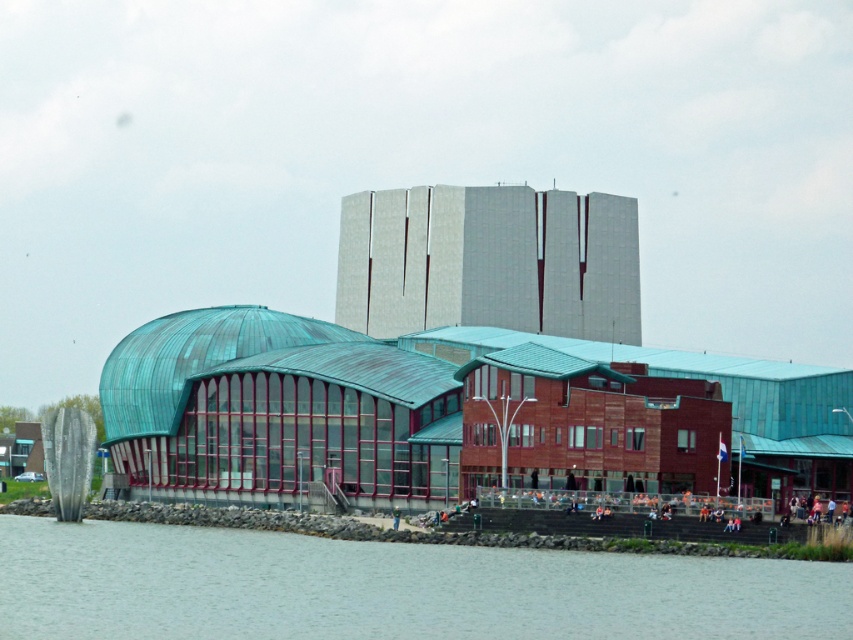
I want to click on gray concrete river at lower left, so click(x=389, y=588).

Describe the element at coordinates (389, 588) in the screenshot. I see `gray concrete river at lower left` at that location.

This screenshot has height=640, width=853. In order to click on gray concrete river at lower left in this screenshot , I will do coord(389,588).